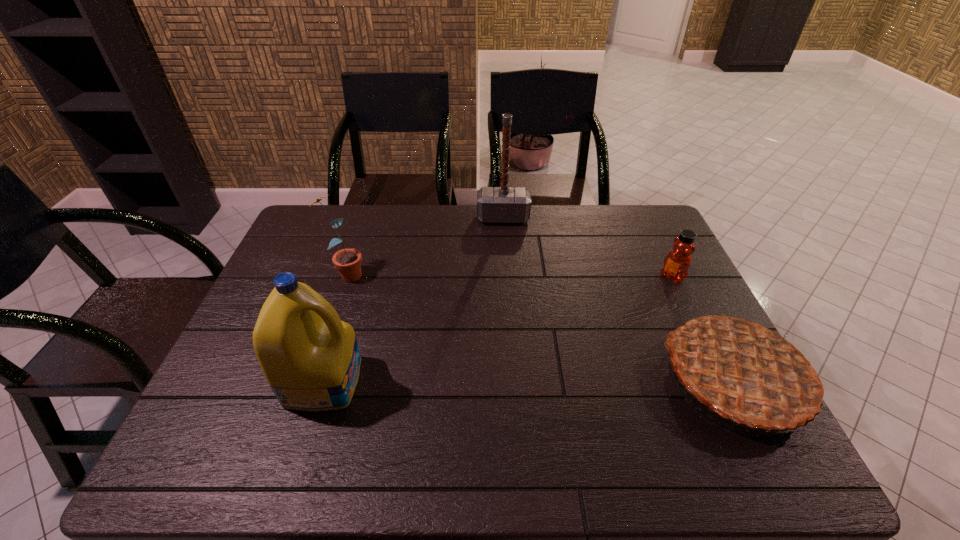
This screenshot has width=960, height=540. Identify the location of object positioned at the left edge. (348, 261).

This screenshot has height=540, width=960. Find the location of `pie that is at the right edge`. pie that is at the right edge is located at coordinates (747, 370).

The image size is (960, 540). I want to click on honey at the right edge, so click(677, 262).

Image resolution: width=960 pixels, height=540 pixels. Find the location of `object located in the near right corner section of the desktop`. object located in the near right corner section of the desktop is located at coordinates (747, 370).

At what (x,y) coordinates should I click in order to perform the action: click on vacant area at the far edge. Please return your answer as a coordinate pair (x, y). This screenshot has width=960, height=540. Looking at the image, I should click on (432, 234).

In the image, there is a desktop. At what (x,y) coordinates should I click in order to perform the action: click on vacant space at the near edge. Please return your answer as a coordinate pair (x, y). The height and width of the screenshot is (540, 960). Looking at the image, I should click on (576, 403).

The image size is (960, 540). In order to click on vacant position at the left edge of the desktop in this screenshot , I will do (x=316, y=284).

The width and height of the screenshot is (960, 540). In order to click on vacant space at the far left corner of the desktop in this screenshot , I will do `click(315, 218)`.

In the image, there is a desktop. Find the location of `free region at the far right corner`. free region at the far right corner is located at coordinates tap(655, 246).

Locate an element on the screen. free area in between the pie and the detergent is located at coordinates (530, 380).